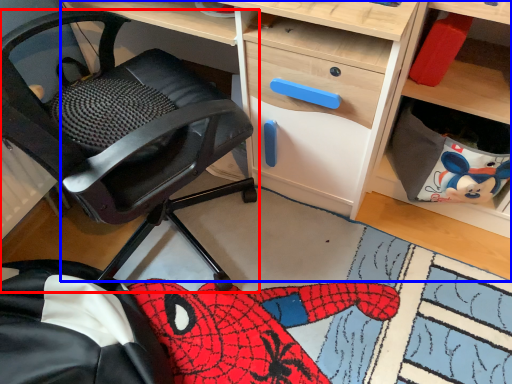
Question: Which of the following is the farthest to the observer, chair (highlighted by a red box) or desk (highlighted by a blue box)?

Choices:
 (A) chair
 (B) desk

Answer: (B)